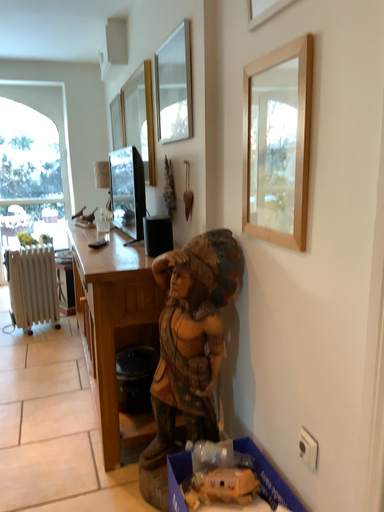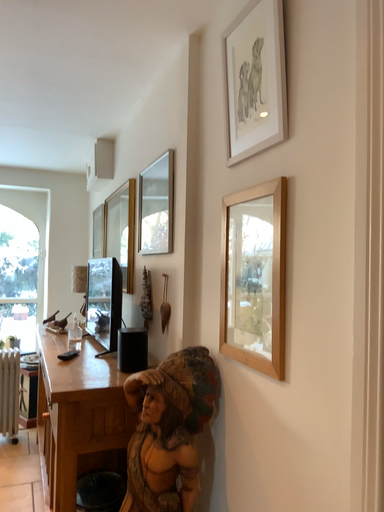
Question: How did the camera likely rotate when shooting the video?

Choices:
 (A) rotated downward
 (B) rotated upward

Answer: (B)